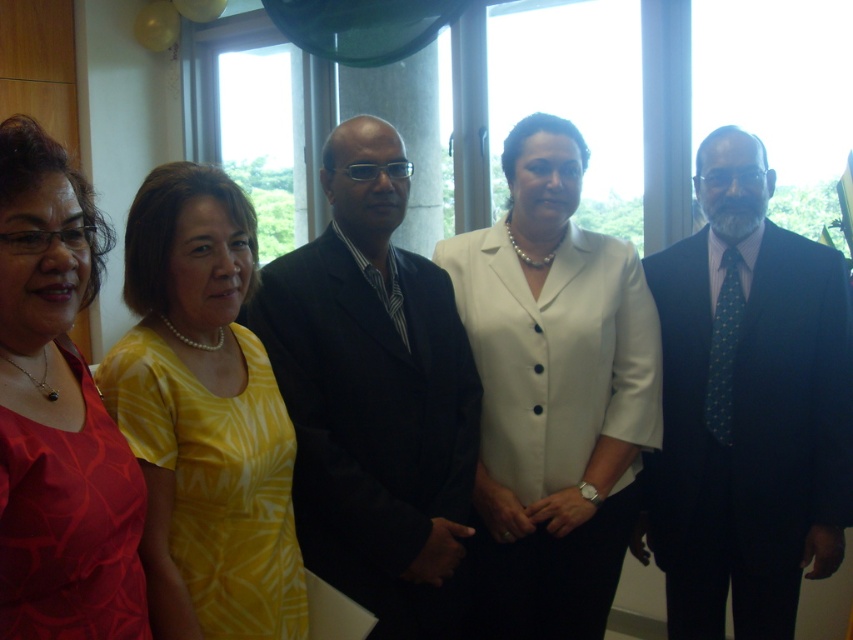
Does dark blue suit at right have a lesser width compared to matte red blouse at left?

In fact, dark blue suit at right might be wider than matte red blouse at left.

Describe the element at coordinates (747, 406) in the screenshot. I see `dark blue suit at right` at that location.

Does point (717, 397) come farther from viewer compared to point (132, 474)?

Yes, it is.

Locate an element on the screen. The height and width of the screenshot is (640, 853). dark blue suit at right is located at coordinates (747, 406).

Is black suit at center above matte red blouse at left?

No.

Can you confirm if black suit at center is positioned below matte red blouse at left?

Correct, black suit at center is located below matte red blouse at left.

Who is more forward, (415, 337) or (1, 451)?

Point (1, 451)

I want to click on black suit at center, so click(374, 396).

Between dark blue suit at right and yellow printed dress at center, which one has less height?

yellow printed dress at center

Who is positioned more to the right, dark blue suit at right or yellow printed dress at center?

A: From the viewer's perspective, dark blue suit at right appears more on the right side.

Describe the element at coordinates (747, 406) in the screenshot. I see `dark blue suit at right` at that location.

Locate an element on the screen. The image size is (853, 640). dark blue suit at right is located at coordinates (747, 406).